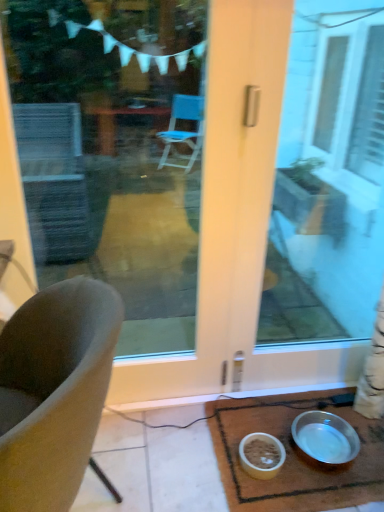
At what (x,y) coordinates should I click in order to perform the action: click on vacant space to the left of matte brown bowl at lower center, arranged as the second bowl when viewed from the right. Please return your answer as a coordinate pair (x, y). Looking at the image, I should click on (221, 458).